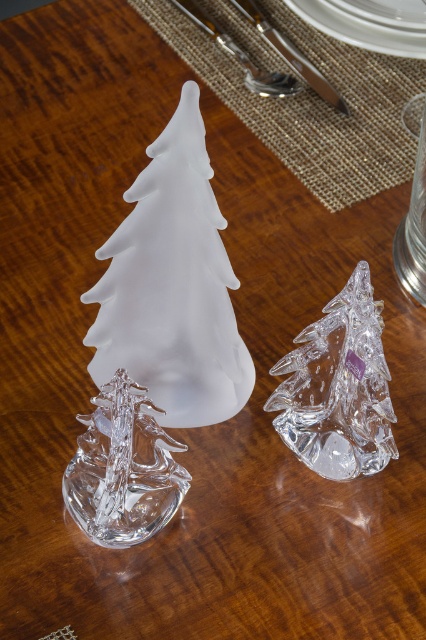
In the scene shown: You are setting up a festive table and have a transparent glass tree at center and a satin silver knife at upper center. Which object is smaller in size?

The transparent glass tree at center is smaller in size compared to the satin silver knife at upper center.

From the picture: You have a small gift box that needs to be placed between the transparent glass tree at center and the satin silver knife at upper center. What is the minimum length the gift box should be to fit snugly between them?

The minimum length should be at least 8.23 inches to fit snugly between the transparent glass tree at center and the satin silver knife at upper center.

You are setting up a Christmas display and want to place the frosted glass tree at center and the polished silver knife at upper center on a shelf. The shelf has a width of 10 inches. Can both items fit side by side without overlapping?

The frosted glass tree at center is wider than the polished silver knife at upper center. However, since the exact widths aren